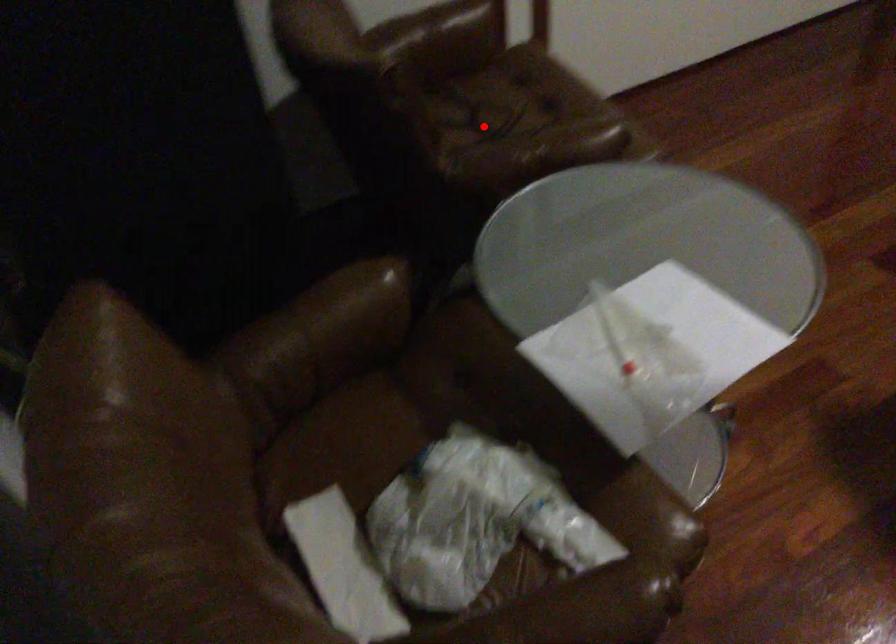
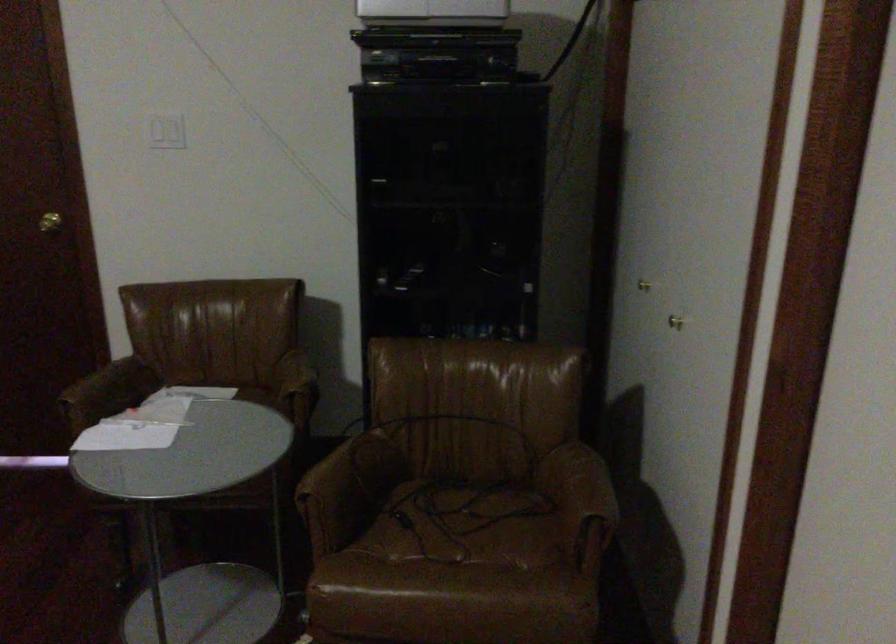
Where in the second image is the point corresponding to the highlighted location from the first image?

(464, 525)